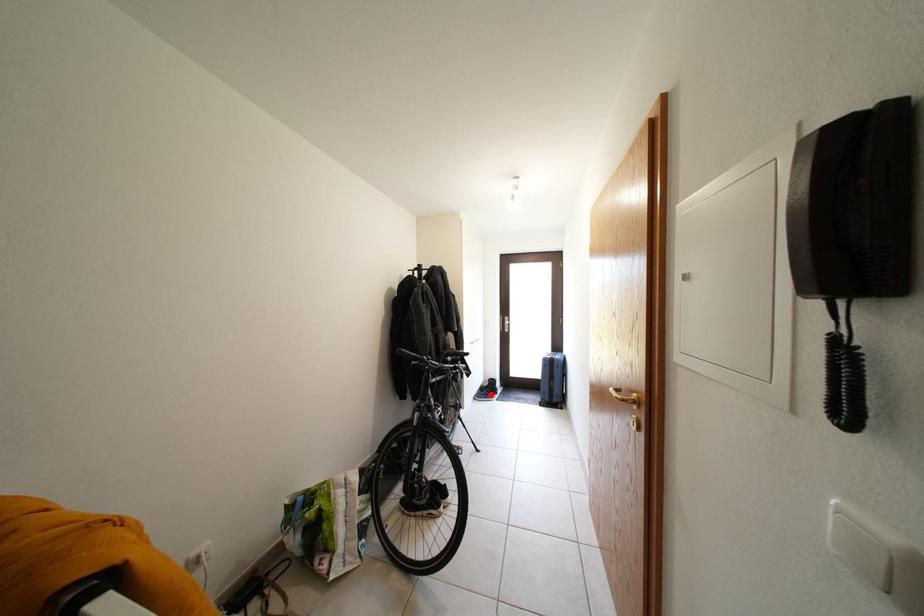
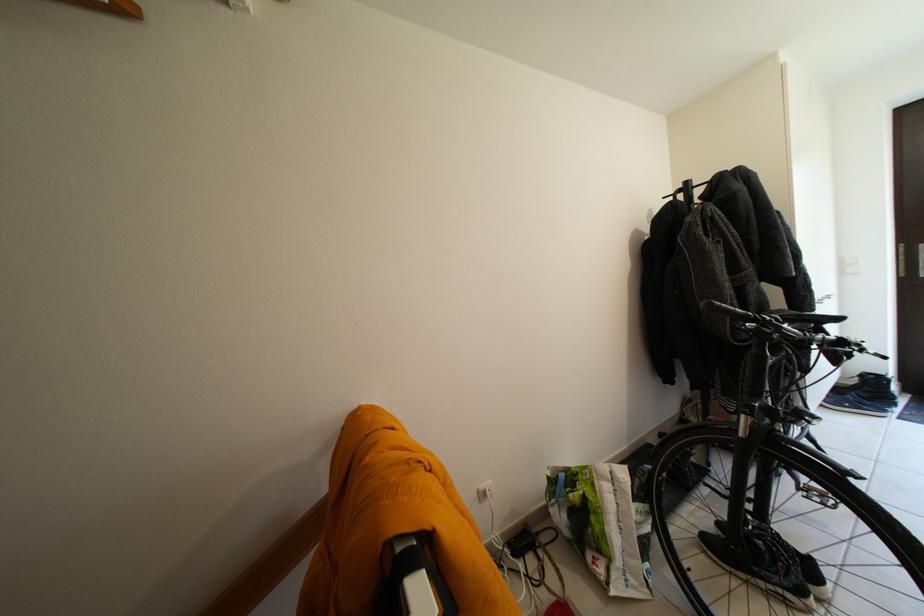
Locate, in the second image, the point that corresponds to the highlighted location in the first image.

(845, 395)